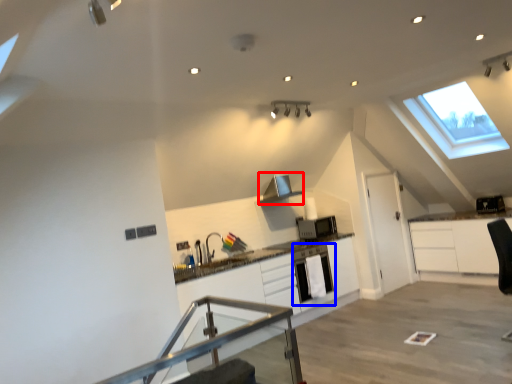
Question: Which object appears closest to the camera in this image, exhaust hood (highlighted by a red box) or dish washer (highlighted by a blue box)?

Choices:
 (A) exhaust hood
 (B) dish washer

Answer: (B)